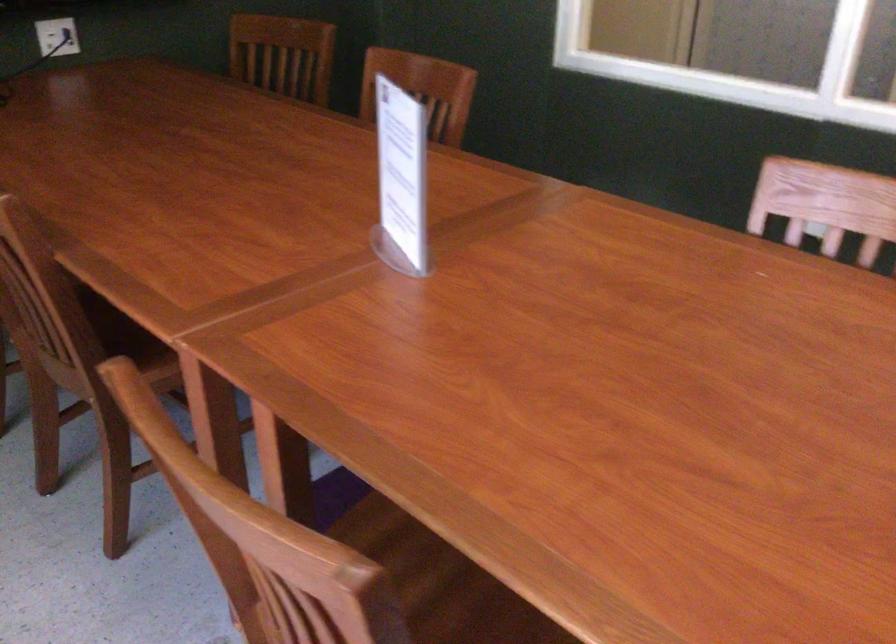
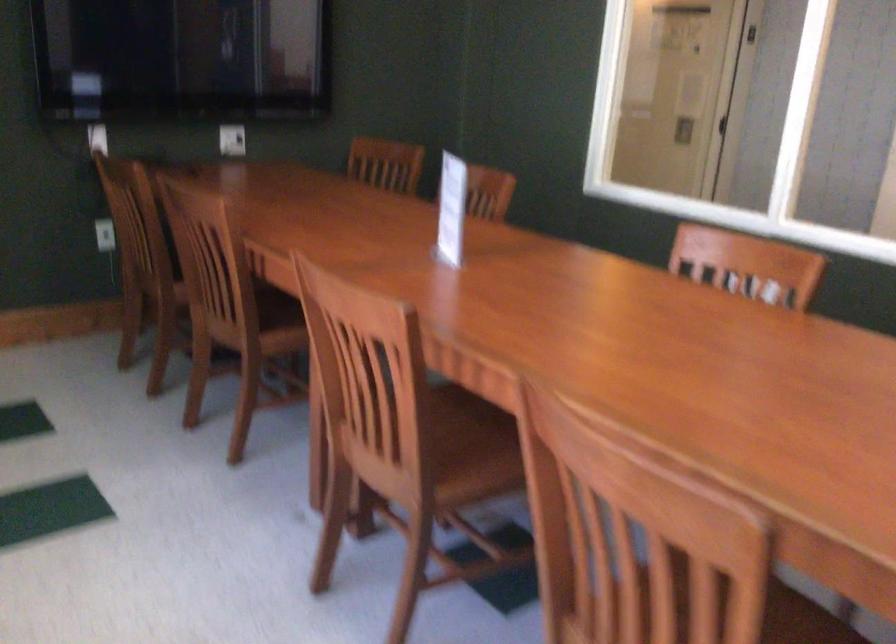
Question: The images are taken continuously from a first-person perspective. In which direction are you moving?

Choices:
 (A) Left
 (B) Right
 (C) Forward
 (D) Backward

Answer: (D)